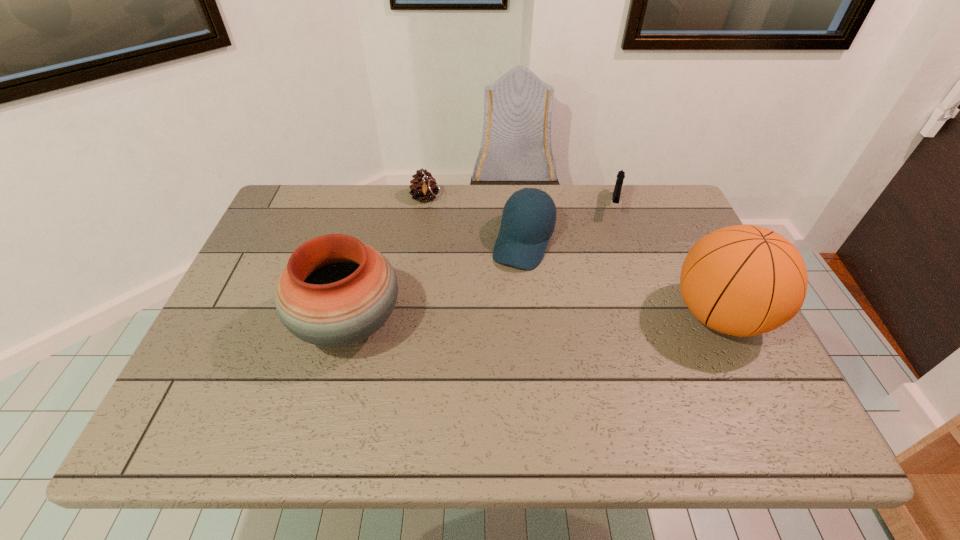
Locate an element on the screen. object at the near edge is located at coordinates (335, 291).

Where is `object present at the right edge`? This screenshot has height=540, width=960. object present at the right edge is located at coordinates (743, 280).

In the image, there is a desktop. What are the coordinates of `vacant region at the far edge` in the screenshot? It's located at (585, 206).

I want to click on free region at the near edge, so click(340, 373).

Where is `vacant space at the left edge`? The height and width of the screenshot is (540, 960). vacant space at the left edge is located at coordinates (237, 333).

This screenshot has width=960, height=540. Identify the location of free region at the right edge of the desktop. (677, 305).

In the image, there is a desktop. Where is `vacant region at the far left corner`? vacant region at the far left corner is located at coordinates (281, 220).

This screenshot has width=960, height=540. Find the location of `vacant space at the far right corner of the desktop`. vacant space at the far right corner of the desktop is located at coordinates (674, 217).

Where is `vacant area that lies between the basketball and the pistol`? This screenshot has width=960, height=540. vacant area that lies between the basketball and the pistol is located at coordinates (666, 261).

Locate an element on the screen. unoccupied area between the basketball and the pistol is located at coordinates (666, 261).